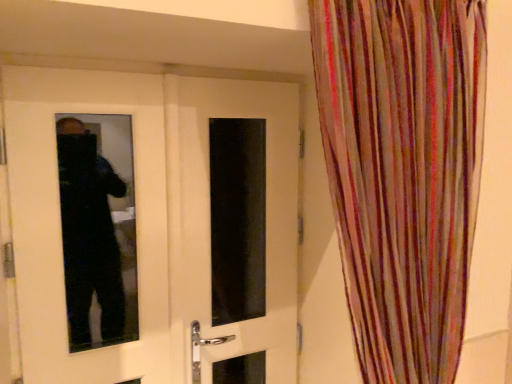
Question: Which direction should I rotate to face white glossy door at center, which appears as the 1th door when viewed from the left, — up or down?

Choices:
 (A) up
 (B) down

Answer: (B)

Question: Is the position of white glossy door at center, the 2th door positioned from the left, more distant than that of white glossy door at center, the 2th door in the right-to-left sequence?

Choices:
 (A) no
 (B) yes

Answer: (B)

Question: Is white glossy door at center, which is counted as the first door, starting from the right, to the left of white glossy door at center, the 2th door in the right-to-left sequence, from the viewer's perspective?

Choices:
 (A) no
 (B) yes

Answer: (A)

Question: From the image's perspective, does white glossy door at center, which is counted as the first door, starting from the right, appear higher than white glossy door at center, the 2th door in the right-to-left sequence?

Choices:
 (A) no
 (B) yes

Answer: (A)

Question: Is white glossy door at center, the 2th door positioned from the left, far away from white glossy door at center, which appears as the 1th door when viewed from the left?

Choices:
 (A) yes
 (B) no

Answer: (B)

Question: From a real-world perspective, does white glossy door at center, which is counted as the first door, starting from the right, sit lower than white glossy door at center, which appears as the 1th door when viewed from the left?

Choices:
 (A) no
 (B) yes

Answer: (B)

Question: Considering the relative sizes of white glossy door at center, the 2th door positioned from the left, and white glossy door at center, the 2th door in the right-to-left sequence, in the image provided, is white glossy door at center, the 2th door positioned from the left, shorter than white glossy door at center, the 2th door in the right-to-left sequence,?

Choices:
 (A) no
 (B) yes

Answer: (B)

Question: Can you confirm if white glossy door at center, the 2th door positioned from the left, is smaller than multicolored sheer curtain at right?

Choices:
 (A) yes
 (B) no

Answer: (A)

Question: Could multicolored sheer curtain at right be considered to be inside white glossy door at center, which is counted as the first door, starting from the right?

Choices:
 (A) yes
 (B) no

Answer: (B)

Question: Can you confirm if white glossy door at center, the 2th door positioned from the left, is wider than multicolored sheer curtain at right?

Choices:
 (A) no
 (B) yes

Answer: (A)

Question: Are white glossy door at center, which is counted as the first door, starting from the right, and multicolored sheer curtain at right making contact?

Choices:
 (A) no
 (B) yes

Answer: (A)

Question: From the image's perspective, would you say white glossy door at center, the 2th door positioned from the left, is shown under multicolored sheer curtain at right?

Choices:
 (A) yes
 (B) no

Answer: (A)

Question: Is the position of white glossy door at center, the 2th door positioned from the left, more distant than that of multicolored sheer curtain at right?

Choices:
 (A) yes
 (B) no

Answer: (A)

Question: Can you confirm if white glossy door at center, the 2th door in the right-to-left sequence, is bigger than multicolored sheer curtain at right?

Choices:
 (A) yes
 (B) no

Answer: (B)